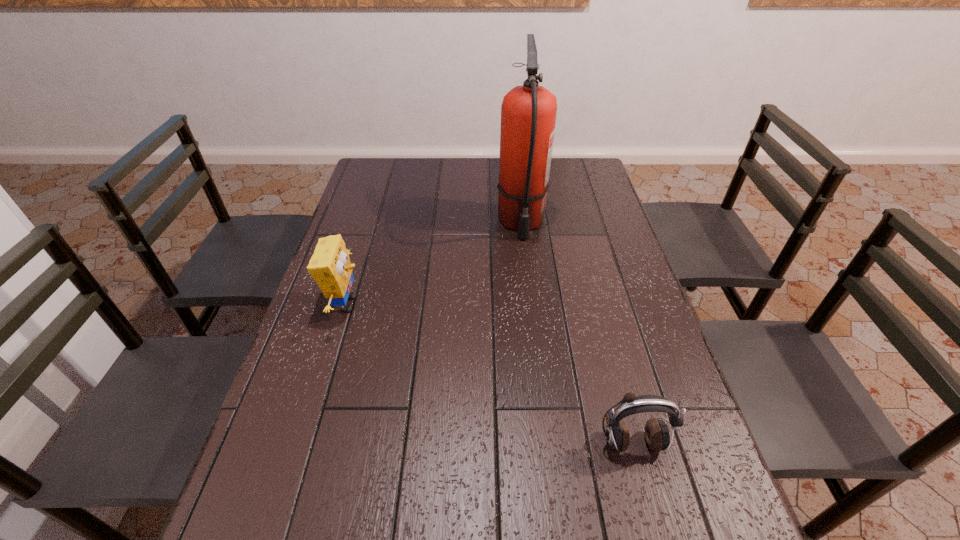
You are a GUI agent. You are given a task and a screenshot of the screen. Output one action in this format:
    pyautogui.click(x=<x>, y=<y>)
    Task: Click on the farthest object
    The image size is (960, 540).
    Given the screenshot: What is the action you would take?
    pyautogui.click(x=528, y=113)

The width and height of the screenshot is (960, 540). In order to click on fire extinguisher in this screenshot , I will do `click(528, 113)`.

At what (x,y) coordinates should I click in order to perform the action: click on sponge. Please return your answer as a coordinate pair (x, y). The width and height of the screenshot is (960, 540). Looking at the image, I should click on (330, 266).

Where is `the second farthest object`? This screenshot has width=960, height=540. the second farthest object is located at coordinates (330, 266).

Locate an element on the screen. The image size is (960, 540). the nearest object is located at coordinates (657, 435).

The height and width of the screenshot is (540, 960). Identify the location of the rightmost object. (657, 435).

I want to click on vacant position located on the nozzle of the tallest object, so point(533,329).

Identify the location of vacant area located 0.050m on the face of the leftmost object. (383, 305).

The width and height of the screenshot is (960, 540). What are the coordinates of `free spot located 0.120m on the ear pads of the rightmost object` in the screenshot? It's located at (653, 524).

Locate an element on the screen. The width and height of the screenshot is (960, 540). object at the left edge is located at coordinates (330, 266).